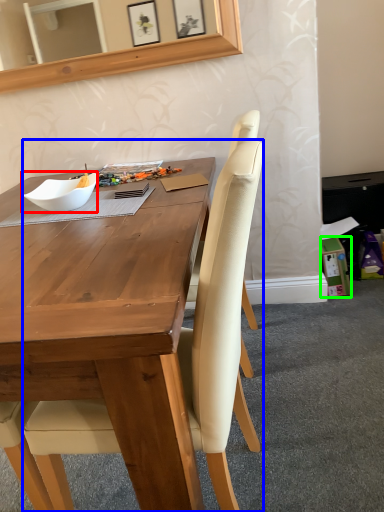
Question: Based on their relative distances, which object is nearer to bowl (highlighted by a red box)? Choose from chair (highlighted by a blue box) and box (highlighted by a green box).

Choices:
 (A) chair
 (B) box

Answer: (A)